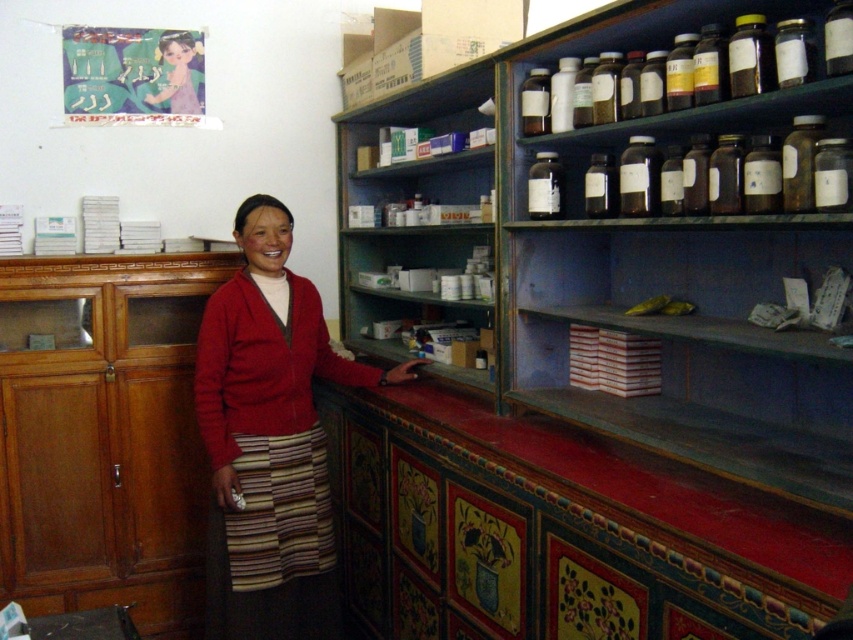
Question: Is red sweater at center smaller than white cardboard boxes at center?

Choices:
 (A) yes
 (B) no

Answer: (B)

Question: Among these objects, which one is farthest from the camera?

Choices:
 (A) white cardboard boxes at upper center
 (B) translucent glass bottles at upper right
 (C) white cardboard boxes at center

Answer: (C)

Question: Does green painted wood shelves at center lie in front of translucent glass bottles at upper right?

Choices:
 (A) yes
 (B) no

Answer: (B)

Question: Which object is farther from the camera taking this photo?

Choices:
 (A) translucent glass bottles at upper right
 (B) red sweater at center

Answer: (B)

Question: Which point is farther to the camera?

Choices:
 (A) green painted wood shelves at center
 (B) red sweater at center
 (C) matte purple dress at upper left
 (D) white cardboard boxes at upper center

Answer: (C)

Question: Can you confirm if translucent glass bottles at upper right is smaller than white cardboard boxes at center?

Choices:
 (A) no
 (B) yes

Answer: (B)